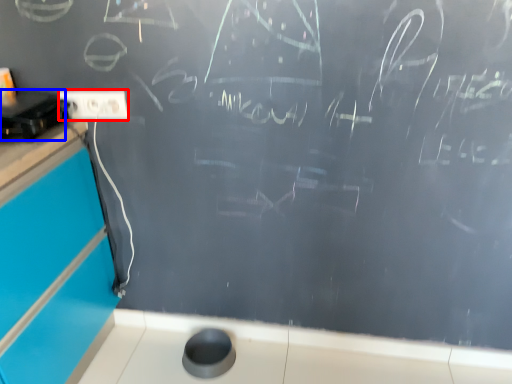
Question: Which object appears closest to the camera in this image, electric outlet (highlighted by a red box) or appliance (highlighted by a blue box)?

Choices:
 (A) electric outlet
 (B) appliance

Answer: (B)